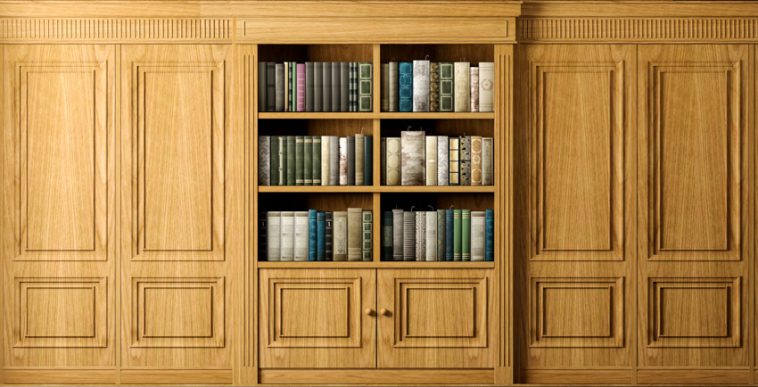
The image size is (758, 387). I want to click on 10 square trim panels, so click(96, 141), click(218, 121), click(96, 309), click(215, 296), click(349, 320), click(399, 325), click(528, 316), click(647, 304), click(653, 214), click(612, 212).